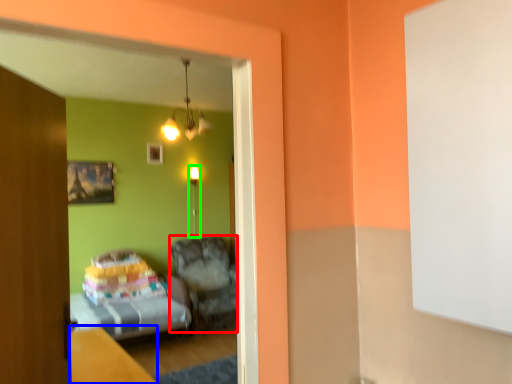
Question: Based on their relative distances, which object is nearer to furniture (highlighted by a red box)? Choose from table (highlighted by a blue box) and light fixture (highlighted by a green box).

Choices:
 (A) table
 (B) light fixture

Answer: (B)